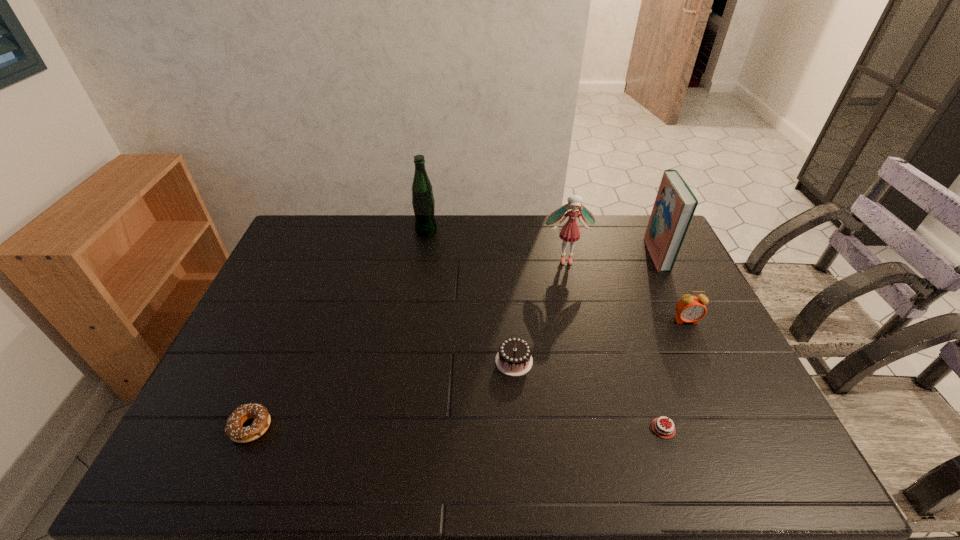
Where is `the right chocolate cake`? The height and width of the screenshot is (540, 960). the right chocolate cake is located at coordinates pyautogui.click(x=661, y=428).

You are a GUI agent. You are given a task and a screenshot of the screen. Output one action in this format:
    pyautogui.click(x=<x>, y=<y>)
    Task: Click on the vacant region located on the front of the second object from left to right
    
    Given the screenshot: What is the action you would take?
    pyautogui.click(x=421, y=262)

You are a GUI agent. You are given a task and a screenshot of the screen. Output one action in this format:
    pyautogui.click(x=<x>, y=<y>)
    Task: Click on the vacant region located 0.350m on the cover of the hardback book
    Image resolution: width=960 pixels, height=540 pixels.
    Given the screenshot: What is the action you would take?
    pyautogui.click(x=549, y=254)

Identify the location of free space located on the cover of the hardback book. This screenshot has width=960, height=540. (569, 254).

What are the coordinates of `free space located on the cover of the hardback book` in the screenshot? It's located at (538, 254).

Find the location of `free space located 0.130m on the front-facing side of the fourth object from right to left`. free space located 0.130m on the front-facing side of the fourth object from right to left is located at coordinates (573, 293).

I want to click on blank area located 0.130m on the face of the fourth farthest object, so click(x=705, y=361).

Where is `free space located 0.190m on the left of the taller chocolate cake`? Image resolution: width=960 pixels, height=540 pixels. free space located 0.190m on the left of the taller chocolate cake is located at coordinates point(425,361).

The image size is (960, 540). I want to click on vacant region located 0.210m on the right of the doughnut, so click(x=359, y=427).

At what (x,y) coordinates should I click in order to perform the action: click on free space located on the left of the right chocolate cake. Please return your answer as a coordinate pair (x, y). Image resolution: width=960 pixels, height=540 pixels. Looking at the image, I should click on (552, 428).